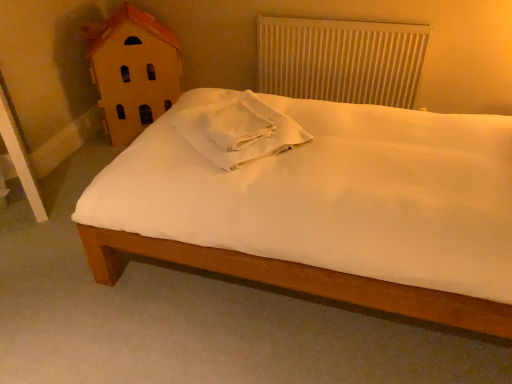
At what (x,y) coordinates should I click in order to perform the action: click on white cotton towel at center. Please return your answer as a coordinate pair (x, y). The image size is (512, 384). Looking at the image, I should click on coord(238,129).

At what (x,y) coordinates should I click in order to perform the action: click on white textured radiator at upper center. Please return your answer as a coordinate pair (x, y). Looking at the image, I should click on (341, 60).

In the scene shown: Would you say white cotton towel at center is inside or outside wooden house at left?

white cotton towel at center exists outside the volume of wooden house at left.

Which object is thinner, white cotton towel at center or wooden house at left?

With smaller width is wooden house at left.

Is white cotton towel at center further to the viewer compared to wooden house at left?

No, white cotton towel at center is in front of wooden house at left.

Is white matte bed at center facing away from white cotton towel at center?

No.

Is white matte bed at center surrounding white cotton towel at center?

No, white cotton towel at center is not surrounded by white matte bed at center.

Is point (378, 115) in front of point (187, 108)?

Yes, it is.

Is white matte bed at center bigger or smaller than white cotton towel at center?

Considering their sizes, white matte bed at center takes up more space than white cotton towel at center.

From a real-world perspective, does white matte bed at center sit lower than wooden house at left?

Correct, in the physical world, white matte bed at center is lower than wooden house at left.

Is white matte bed at center bigger than wooden house at left?

Yes, white matte bed at center is bigger than wooden house at left.

In the scene shown: How many degrees apart are the facing directions of white matte bed at center and wooden house at left?

The facing directions of white matte bed at center and wooden house at left are 125 degrees apart.

In the scene shown: Is white cotton towel at center oriented towards white matte bed at center?

No, white cotton towel at center is not oriented towards white matte bed at center.

From the image's perspective, is white cotton towel at center over white matte bed at center?

Yes, from the image's perspective, white cotton towel at center is above white matte bed at center.

How many degrees apart are the facing directions of white cotton towel at center and white matte bed at center?

47 degrees.

Is white cotton towel at center bigger than white matte bed at center?

Incorrect, white cotton towel at center is not larger than white matte bed at center.

Considering the relative positions of white matte bed at center and white textured radiator at upper center in the image provided, is white matte bed at center to the left of white textured radiator at upper center from the viewer's perspective?

Yes, white matte bed at center is to the left of white textured radiator at upper center.

Is the surface of white matte bed at center in direct contact with white textured radiator at upper center?

white matte bed at center and white textured radiator at upper center are not in contact.

Does white matte bed at center come behind white textured radiator at upper center?

No, it is not.

Is white matte bed at center aimed at white textured radiator at upper center?

No, white matte bed at center is not aimed at white textured radiator at upper center.

Considering the points (265, 147) and (423, 32), which point is behind, point (265, 147) or point (423, 32)?

The point (423, 32) is farther.

Is white cotton towel at center facing away from white textured radiator at upper center?

Absolutely, white cotton towel at center is directed away from white textured radiator at upper center.

Considering the sizes of objects white cotton towel at center and white textured radiator at upper center in the image provided, who is wider, white cotton towel at center or white textured radiator at upper center?

white cotton towel at center is wider.

Would you say wooden house at left is inside or outside white textured radiator at upper center?

wooden house at left lies outside white textured radiator at upper center.

How far apart are wooden house at left and white textured radiator at upper center?

35.08 inches.

In terms of width, does wooden house at left look wider or thinner when compared to white textured radiator at upper center?

Considering their sizes, wooden house at left looks broader than white textured radiator at upper center.

From the picture: Can you see wooden house at left touching white textured radiator at upper center?

They are not placed beside each other.

Image resolution: width=512 pixels, height=384 pixels. What are the coordinates of `toy behind the white cotton towel at center` in the screenshot? It's located at (133, 70).

I want to click on material that is on the right side of white matte bed at center, so click(x=238, y=129).

Estimate the real-world distances between objects in this image. Which object is further from white matte bed at center, wooden house at left or white cotton towel at center?

The object further to white matte bed at center is wooden house at left.

Considering their positions, is white matte bed at center positioned further to white textured radiator at upper center than white cotton towel at center?

white matte bed at center is positioned further to the anchor white textured radiator at upper center.

When comparing their distances from white matte bed at center, does wooden house at left or white textured radiator at upper center seem closer?

white textured radiator at upper center.

Considering their positions, is white textured radiator at upper center positioned closer to wooden house at left than white matte bed at center?

Based on the image, white textured radiator at upper center appears to be nearer to wooden house at left.

Which object lies further to the anchor point white textured radiator at upper center, white cotton towel at center or wooden house at left?

white cotton towel at center lies further to white textured radiator at upper center than the other object.

When comparing their distances from wooden house at left, does white cotton towel at center or white textured radiator at upper center seem further?

The object further to wooden house at left is white textured radiator at upper center.

Based on their spatial positions, is white textured radiator at upper center or white matte bed at center further from white cotton towel at center?

Based on the image, white textured radiator at upper center appears to be further to white cotton towel at center.

Considering their positions, is white matte bed at center positioned further to wooden house at left than white cotton towel at center?

white matte bed at center is further to wooden house at left.

This screenshot has width=512, height=384. Find the location of `toy between white matte bed at center and white textured radiator at upper center along the z-axis`. toy between white matte bed at center and white textured radiator at upper center along the z-axis is located at coordinates (133, 70).

The height and width of the screenshot is (384, 512). In order to click on material between white matte bed at center and wooden house at left along the z-axis in this screenshot , I will do `click(238, 129)`.

Locate an element on the screen. material located between wooden house at left and white textured radiator at upper center in the left-right direction is located at coordinates click(238, 129).

Find the location of a particular element. material between white matte bed at center and white textured radiator at upper center along the z-axis is located at coordinates (238, 129).